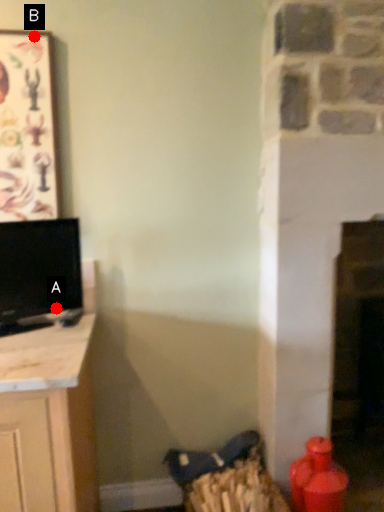
Question: Two points are circled on the image, labeled by A and B beside each circle. Among these points, which one is farthest from the camera?

Choices:
 (A) A is further
 (B) B is further

Answer: (A)